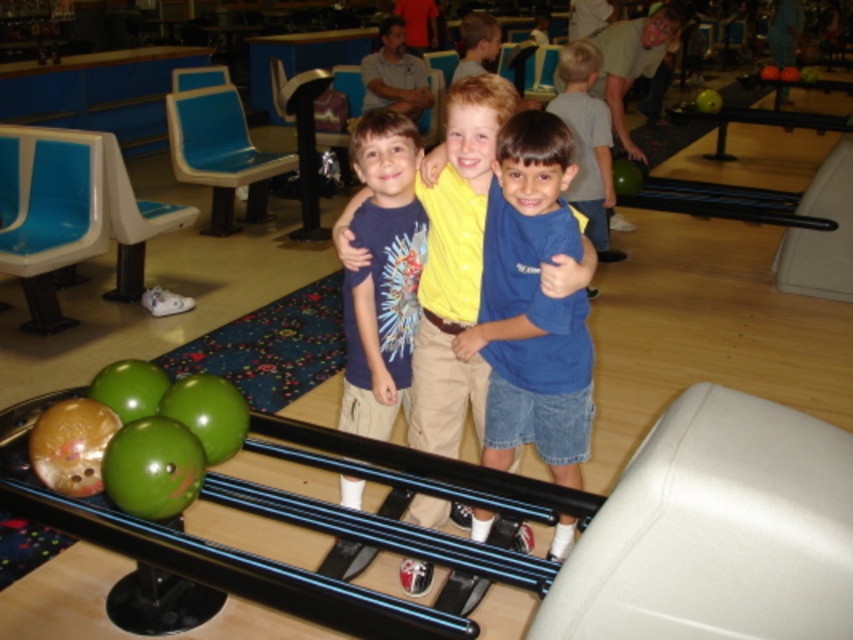
Question: Which of the following is the closest to the observer?

Choices:
 (A) blue denim shorts at center
 (B) blue cotton shirt at center

Answer: (A)

Question: Can you confirm if blue denim shorts at center is positioned above blue cotton shirt at center?

Choices:
 (A) yes
 (B) no

Answer: (B)

Question: Is the position of blue denim shorts at center more distant than that of blue cotton shirt at center?

Choices:
 (A) yes
 (B) no

Answer: (B)

Question: Which point appears closest to the camera in this image?

Choices:
 (A) (483, 349)
 (B) (372, 221)

Answer: (A)

Question: Does blue denim shorts at center appear on the right side of blue cotton shirt at center?

Choices:
 (A) no
 (B) yes

Answer: (B)